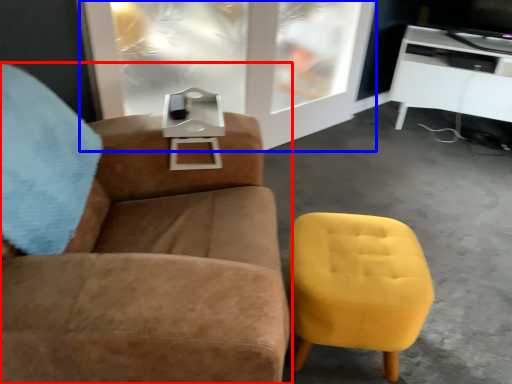
Question: Which point is closer to the camera, chair (highlighted by a red box) or glass door (highlighted by a blue box)?

Choices:
 (A) chair
 (B) glass door

Answer: (A)